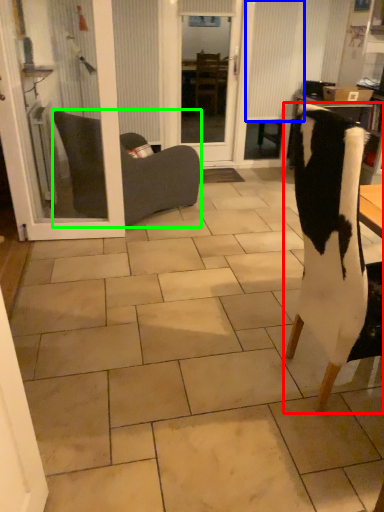
Question: Which object is the closest to the chair (highlighted by a red box)? Choose among these: curtain (highlighted by a blue box) or chair (highlighted by a green box).

Choices:
 (A) curtain
 (B) chair

Answer: (B)